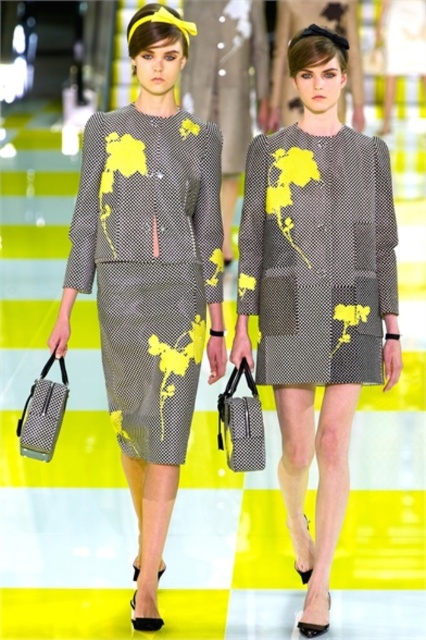
Question: Is the position of matte gray dress at center less distant than that of matte gray dress with yellow floral print at center?

Choices:
 (A) yes
 (B) no

Answer: (A)

Question: In this image, where is matte gray dress at center located relative to textured gray dress at center?

Choices:
 (A) above
 (B) below

Answer: (B)

Question: Among these points, which one is nearest to the camera?

Choices:
 (A) (270, 248)
 (B) (291, 164)

Answer: (B)

Question: Is matte gray dress with yellow floral print at center below textured gray dress at center?

Choices:
 (A) no
 (B) yes

Answer: (B)

Question: Among these points, which one is nearest to the camera?

Choices:
 (A) (262, 380)
 (B) (298, 525)

Answer: (A)

Question: Which object appears farthest from the camera in this image?

Choices:
 (A) matte gray dress with yellow floral print at center
 (B) matte gray dress at center

Answer: (A)